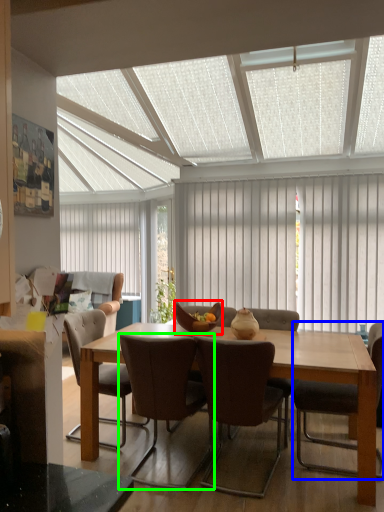
Question: Estimate the real-world distances between objects in this image. Which object is farther from bowl (highlighted by a red box), chair (highlighted by a blue box) or chair (highlighted by a green box)?

Choices:
 (A) chair
 (B) chair

Answer: (A)